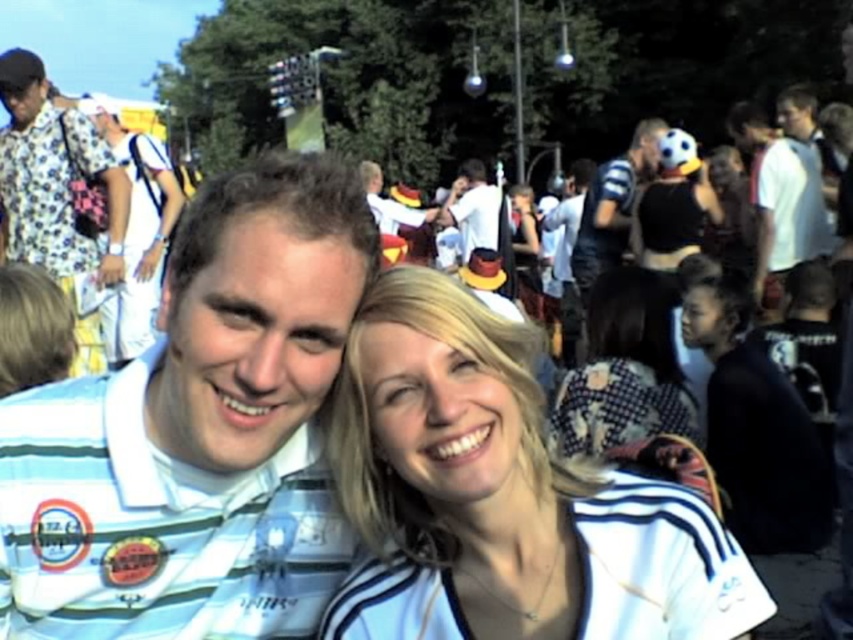
You are a photographer at the event and want to capture a photo that includes both the striped fabric scarf at center and the white cotton shirt at left. Which object should you focus on first to ensure both are in frame?

The striped fabric scarf at center is shorter than the white cotton shirt at left, so you should focus on the white cotton shirt at left first to ensure both are in frame.

You are standing at the center of the image and want to locate the white matte shirt at upper right. Based on the coordinates provided, in which direction should you turn your head to look towards it?

The white matte shirt at upper right is located at coordinates 0.305 on the x axis and 0.921 on the y axis. Since you are at the center, you should turn your head to the upper right direction to look towards it.